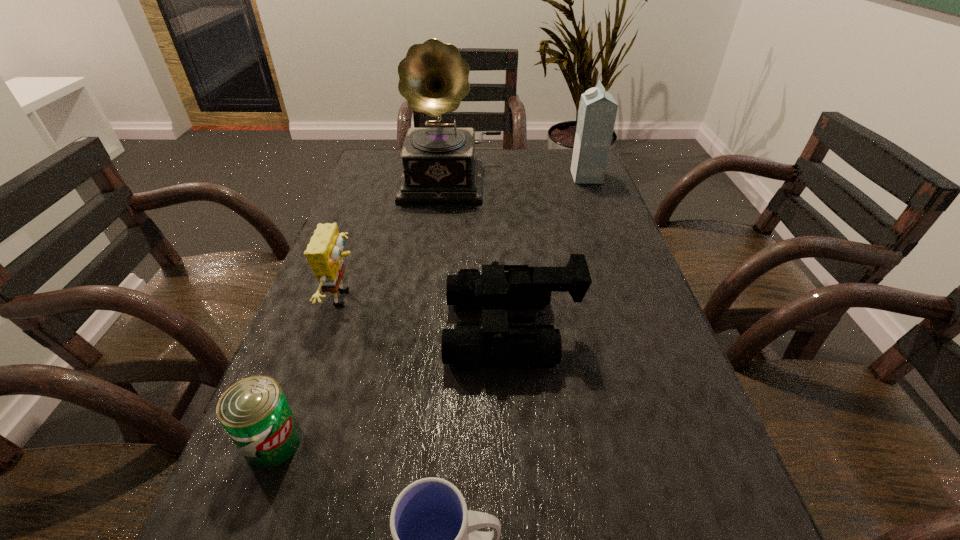
Where is `the third closest object to the nearest object`? The image size is (960, 540). the third closest object to the nearest object is located at coordinates (324, 253).

Select which object appears as the second closest to the sponge. Please provide its 2D coordinates. Your answer should be formatted as a tuple, i.e. [(x, y)], where the tuple contains the x and y coordinates of a point satisfying the conditions above.

[(497, 344)]